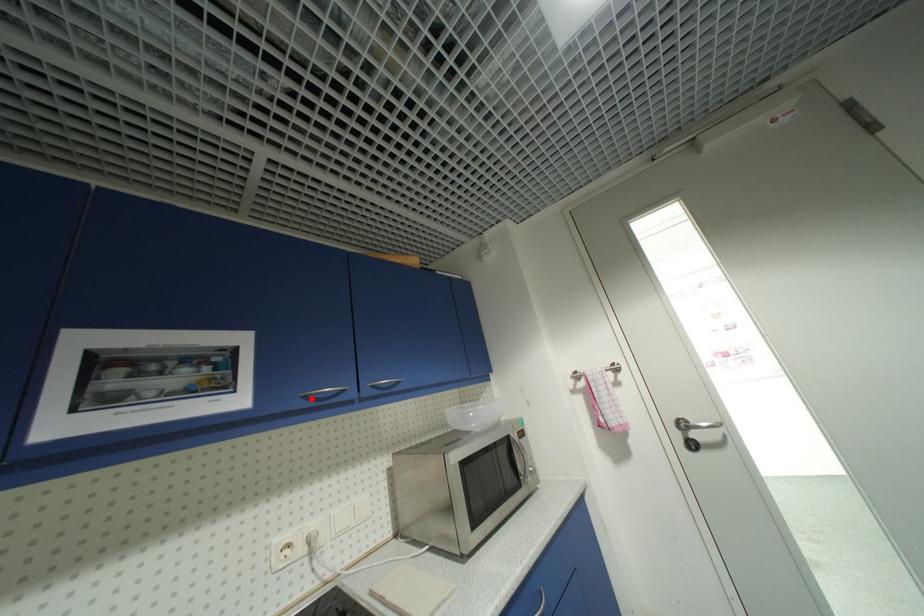
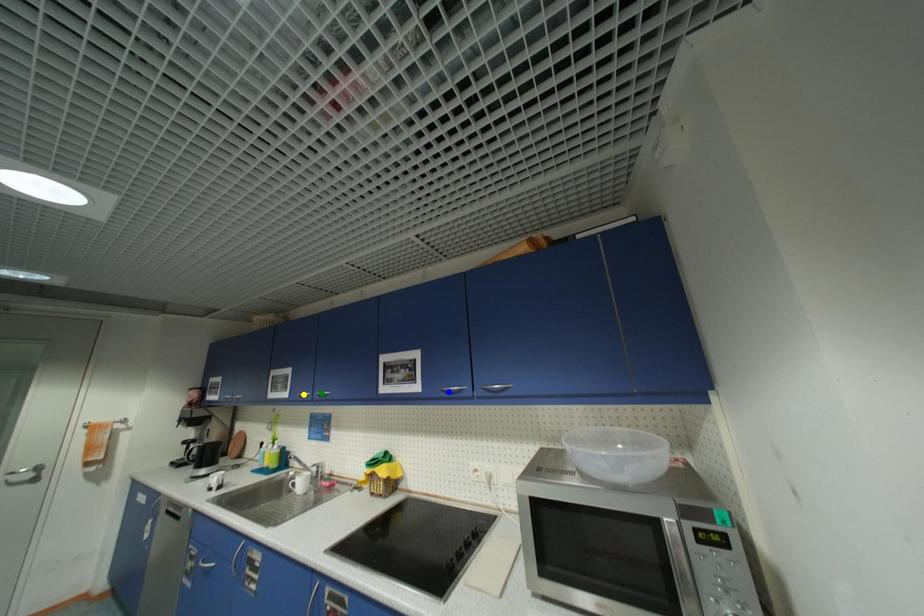
Question: I am providing you with two images of the same scene from different viewpoints. A red point is marked on the first image. You are given multiple points on the second image. Which mark in image 2 goes with the point in image 1?

Choices:
 (A) green point
 (B) blue point
 (C) yellow point

Answer: (B)